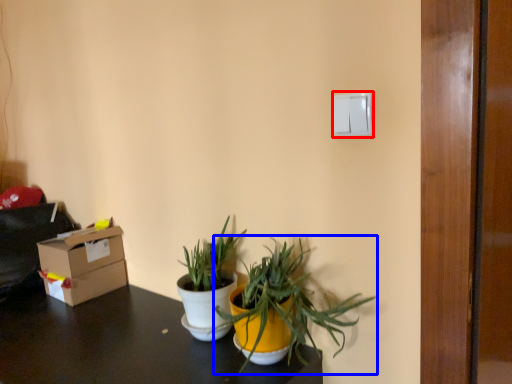
Question: Which object appears closest to the camera in this image, light switch (highlighted by a red box) or houseplant (highlighted by a blue box)?

Choices:
 (A) light switch
 (B) houseplant

Answer: (B)